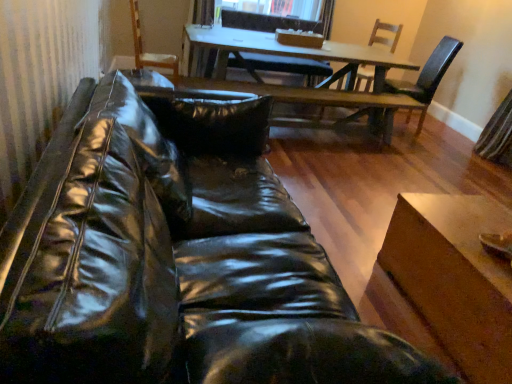
Locate an element on the screen. This screenshot has height=384, width=512. vacant space situated above wooden table at lower right, the first table ordered from the bottom (from a real-world perspective) is located at coordinates (467, 226).